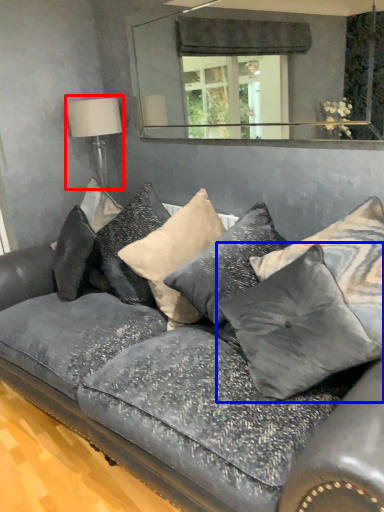
Question: Which of the following is the farthest to the observer, table lamp (highlighted by a red box) or pillow (highlighted by a blue box)?

Choices:
 (A) table lamp
 (B) pillow

Answer: (A)